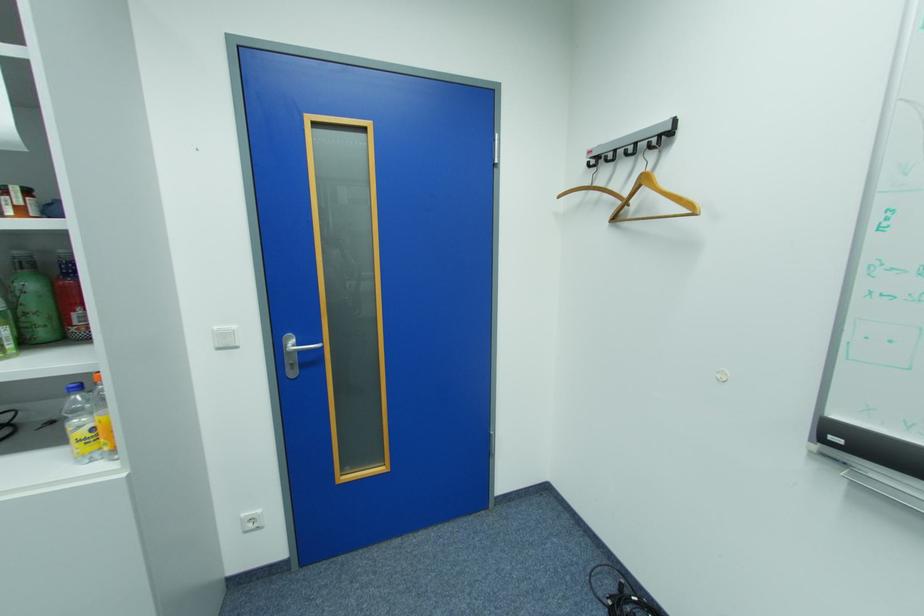
The location [653,201] corresponds to which object?

This point indicates the wooden coat hanger.